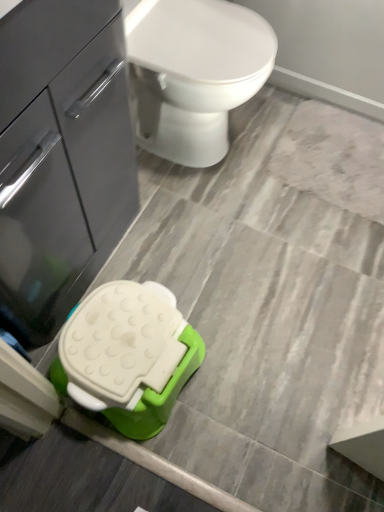
Question: Should I look upward or downward to see matte gray cabinet at left?

Choices:
 (A) down
 (B) up

Answer: (B)

Question: From the image's perspective, would you say matte gray cabinet at left is shown under white glossy toilet at upper center?

Choices:
 (A) no
 (B) yes

Answer: (B)

Question: From the image's perspective, would you say matte gray cabinet at left is positioned over white glossy toilet at upper center?

Choices:
 (A) no
 (B) yes

Answer: (A)

Question: Is matte gray cabinet at left next to white glossy toilet at upper center and touching it?

Choices:
 (A) no
 (B) yes

Answer: (A)

Question: Can you confirm if matte gray cabinet at left is wider than white glossy toilet at upper center?

Choices:
 (A) no
 (B) yes

Answer: (A)

Question: Can you confirm if matte gray cabinet at left is positioned to the right of white glossy toilet at upper center?

Choices:
 (A) no
 (B) yes

Answer: (A)

Question: Is matte gray cabinet at left facing towards white glossy toilet at upper center?

Choices:
 (A) yes
 (B) no

Answer: (B)

Question: Is white glossy toilet at upper center turned away from matte gray cabinet at left?

Choices:
 (A) yes
 (B) no

Answer: (B)

Question: Does white glossy toilet at upper center turn towards matte gray cabinet at left?

Choices:
 (A) no
 (B) yes

Answer: (A)

Question: Can you confirm if white glossy toilet at upper center is taller than matte gray cabinet at left?

Choices:
 (A) yes
 (B) no

Answer: (B)

Question: Does white glossy toilet at upper center have a lesser height compared to matte gray cabinet at left?

Choices:
 (A) no
 (B) yes

Answer: (B)

Question: Is white glossy toilet at upper center smaller than matte gray cabinet at left?

Choices:
 (A) yes
 (B) no

Answer: (A)

Question: Does white glossy toilet at upper center appear on the left side of matte gray cabinet at left?

Choices:
 (A) yes
 (B) no

Answer: (B)

Question: Do you think matte gray cabinet at left is within white glossy toilet at upper center, or outside of it?

Choices:
 (A) outside
 (B) inside

Answer: (A)